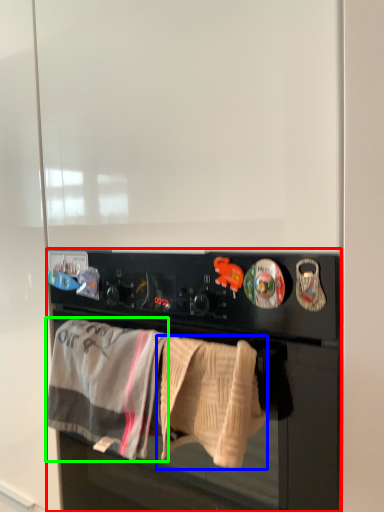
Question: Based on their relative distances, which object is nearer to home appliance (highlighted by a red box)? Choose from bath towel (highlighted by a blue box) and bath towel (highlighted by a green box).

Choices:
 (A) bath towel
 (B) bath towel

Answer: (A)